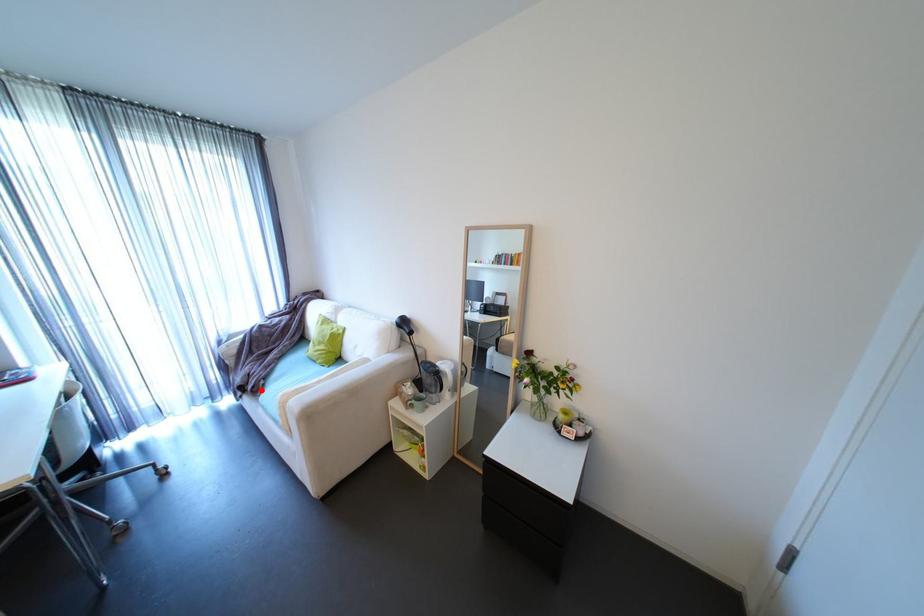
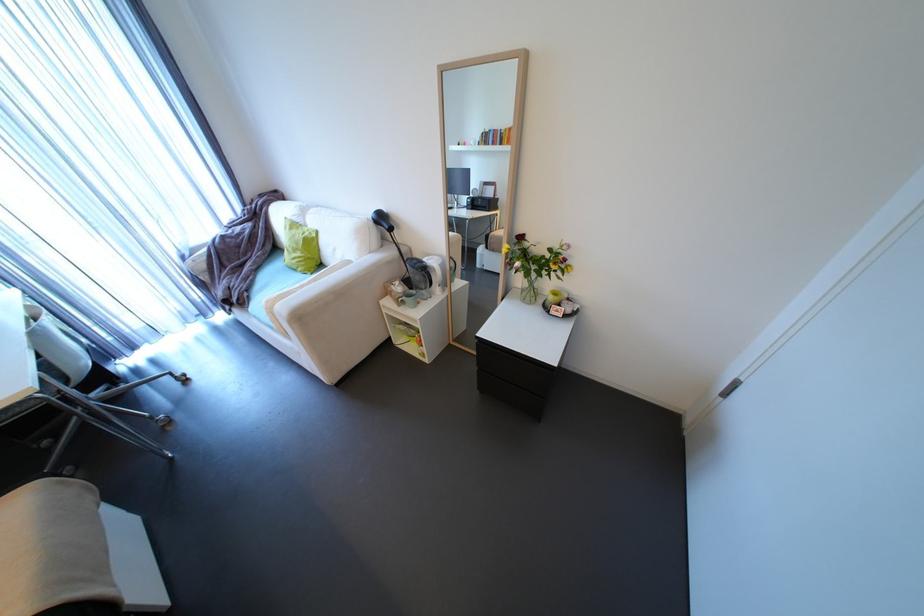
The point at the highlighted location is marked in the first image. Where is the corresponding point in the second image?

(248, 302)